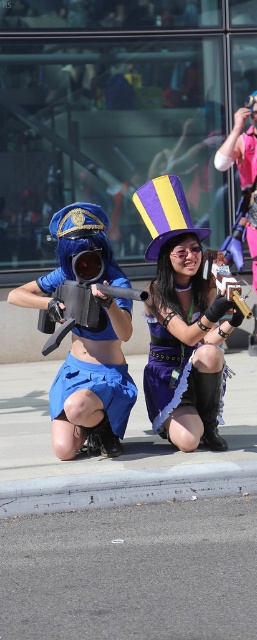
Can you confirm if matte blue uniform at left is bigger than black leather boot at lower center?

Yes.

What do you see at coordinates (94, 385) in the screenshot? I see `matte blue uniform at left` at bounding box center [94, 385].

Does point (124, 378) lie behind point (213, 380)?

Yes, point (124, 378) is farther from viewer.

At what (x,y) coordinates should I click in order to perform the action: click on matte blue uniform at left. Please return your answer as a coordinate pair (x, y). The image size is (257, 640). Looking at the image, I should click on (94, 385).

Between gray asphalt at lower center and gray asphalt curb at lower center, which one appears on the right side from the viewer's perspective?

Positioned to the right is gray asphalt at lower center.

Describe the element at coordinates (132, 572) in the screenshot. I see `gray asphalt at lower center` at that location.

The height and width of the screenshot is (640, 257). I want to click on gray asphalt at lower center, so click(132, 572).

Does gray asphalt at lower center have a greater height compared to purple velvet top hat at upper center?

Incorrect, gray asphalt at lower center's height is not larger of purple velvet top hat at upper center's.

Is gray asphalt at lower center bigger than purple velvet top hat at upper center?

Incorrect, gray asphalt at lower center is not larger than purple velvet top hat at upper center.

Is point (223, 604) farther from camera compared to point (212, 321)?

No, (223, 604) is closer to viewer.

The width and height of the screenshot is (257, 640). Find the location of `gray asphalt at lower center`. gray asphalt at lower center is located at coordinates (132, 572).